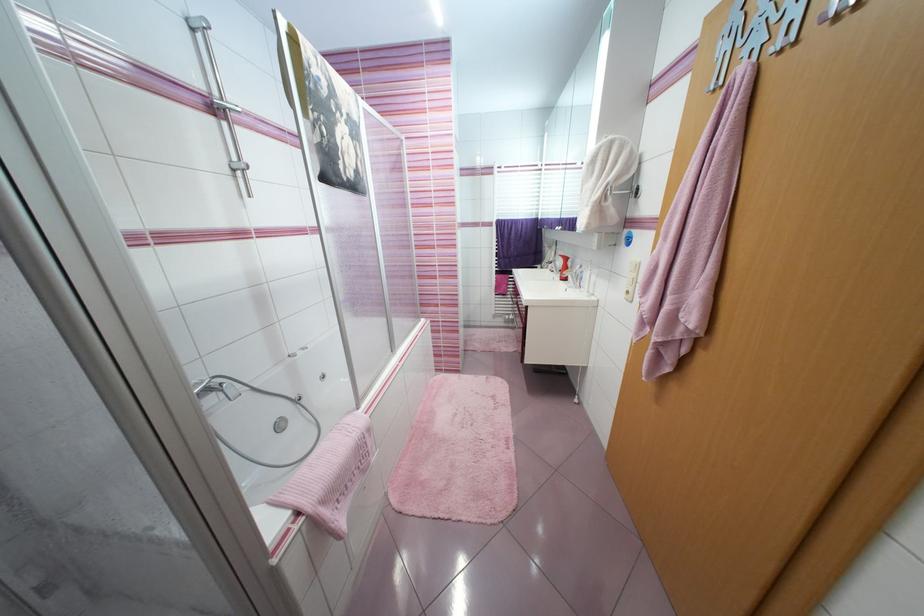
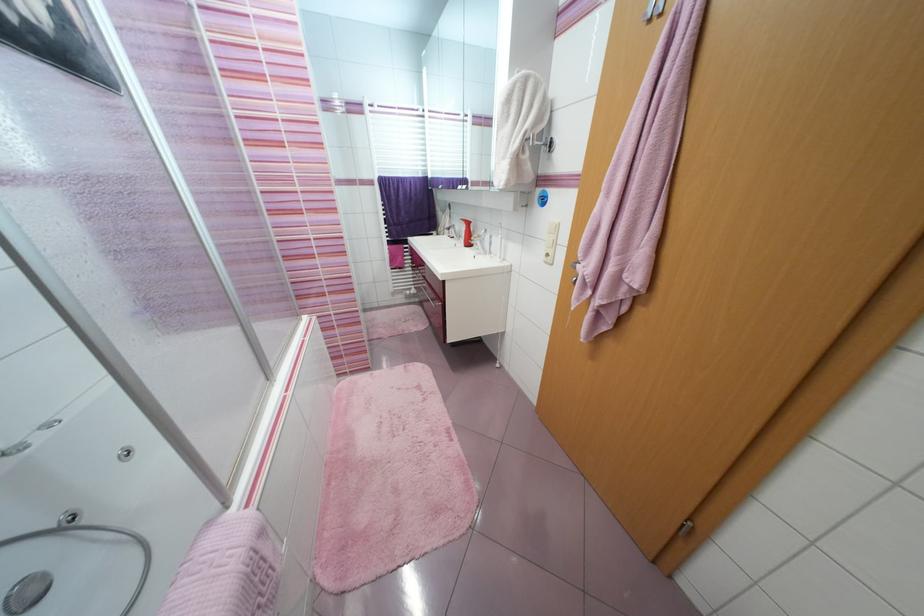
The point at (575, 278) is marked in the first image. Where is the corresponding point in the second image?

(483, 244)